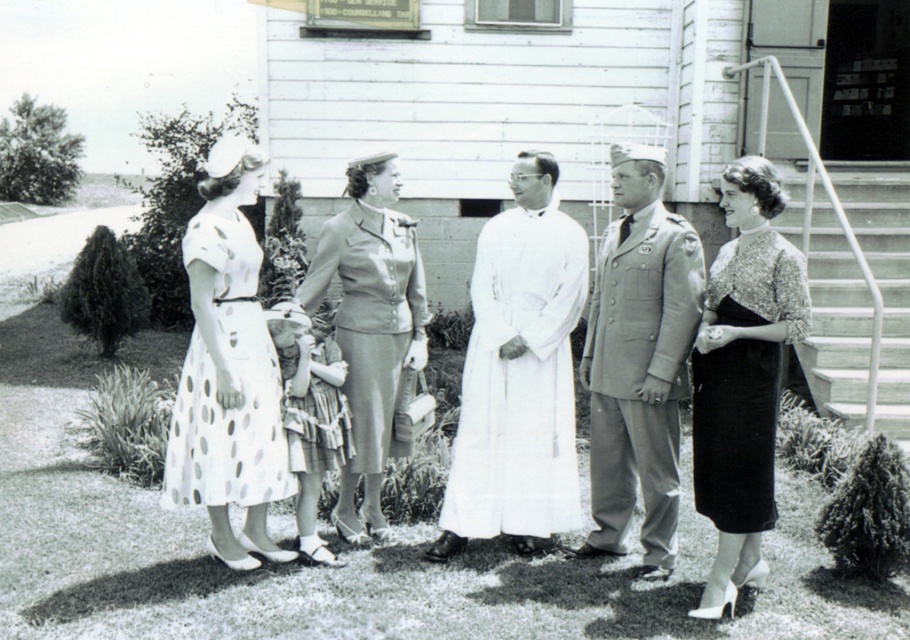
Which of these two, white dotted dress at left or light gray uniform at center, stands shorter?

white dotted dress at left

Locate an element on the screen. This screenshot has height=640, width=910. white dotted dress at left is located at coordinates (268, 349).

Find the location of a particular element. white dotted dress at left is located at coordinates (268, 349).

Between light gray uniform at center and matte gray suit at center, which one appears on the right side from the viewer's perspective?

Positioned to the right is light gray uniform at center.

You are a GUI agent. You are given a task and a screenshot of the screen. Output one action in this format:
    pyautogui.click(x=<x>, y=<y>)
    Task: Click on the light gray uniform at center
    
    Given the screenshot: What is the action you would take?
    pyautogui.click(x=639, y=360)

Consider the image. Who is higher up, light gray uniform at center or shiny black dress at right?

light gray uniform at center is higher up.

Can you confirm if light gray uniform at center is shorter than shiny black dress at right?

In fact, light gray uniform at center may be taller than shiny black dress at right.

Is point (676, 340) farther from camera compared to point (716, 412)?

That is True.

Locate an element on the screen. Image resolution: width=910 pixels, height=640 pixels. light gray uniform at center is located at coordinates (639, 360).